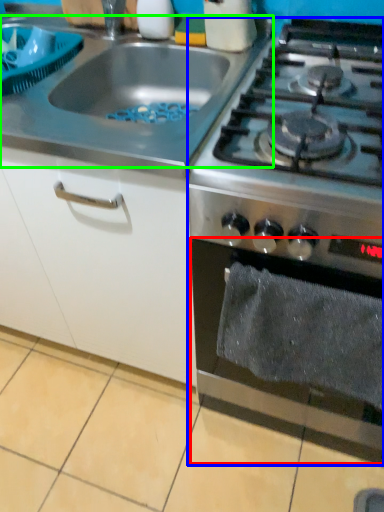
Question: Based on their relative distances, which object is farther from oven (highlighted by a red box)? Choose from gas stove (highlighted by a blue box) and gas stove (highlighted by a green box).

Choices:
 (A) gas stove
 (B) gas stove

Answer: (B)